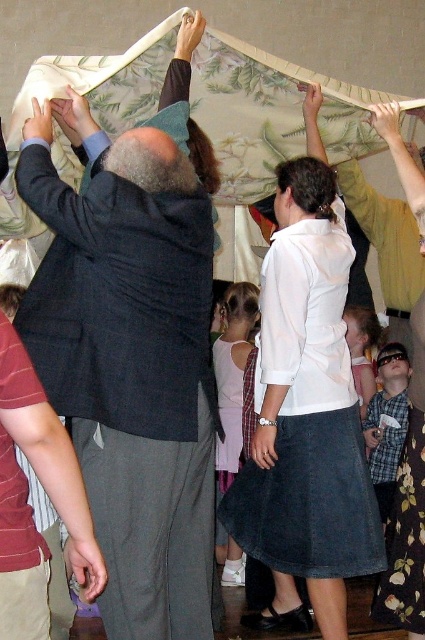
Can you confirm if white cotton shirt at center is shorter than maroon striped shirt at lower left?

No, white cotton shirt at center is not shorter than maroon striped shirt at lower left.

Image resolution: width=425 pixels, height=640 pixels. What are the coordinates of `white cotton shirt at center` in the screenshot? It's located at (306, 410).

Does plaid shirt at center appear on the left side of white satin dress at center?

No, plaid shirt at center is not to the left of white satin dress at center.

What do you see at coordinates (387, 422) in the screenshot?
I see `plaid shirt at center` at bounding box center [387, 422].

Which is in front, point (399, 404) or point (232, 406)?

Positioned in front is point (232, 406).

Locate an element on the screen. plaid shirt at center is located at coordinates (387, 422).

Consider the image. Between white cotton shirt at center and floral print dress at lower right, which one has more height?

white cotton shirt at center

Is white cotton shirt at center in front of floral print dress at lower right?

That is True.

Which is in front, point (268, 532) or point (405, 506)?

Point (405, 506)

Image resolution: width=425 pixels, height=640 pixels. Identify the location of white cotton shirt at center. (306, 410).